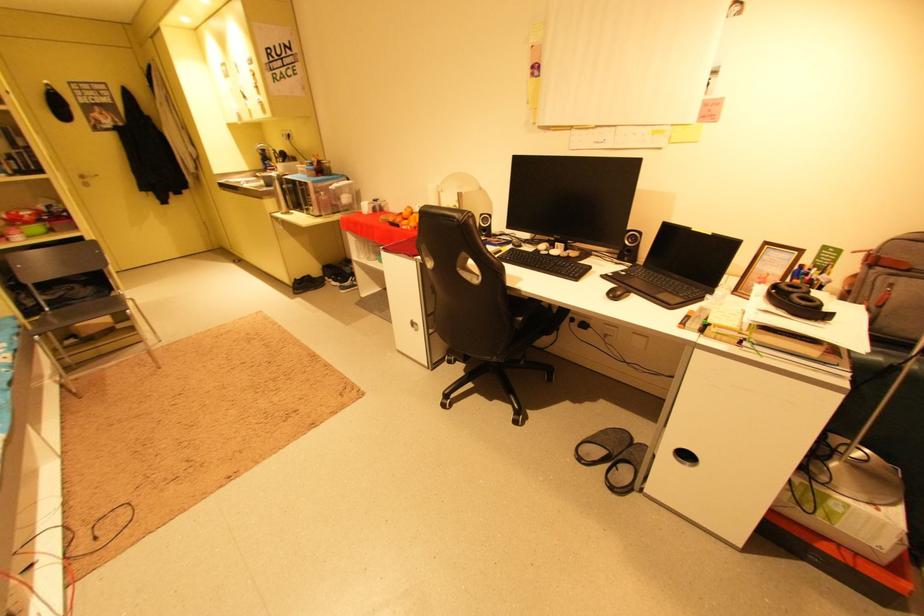
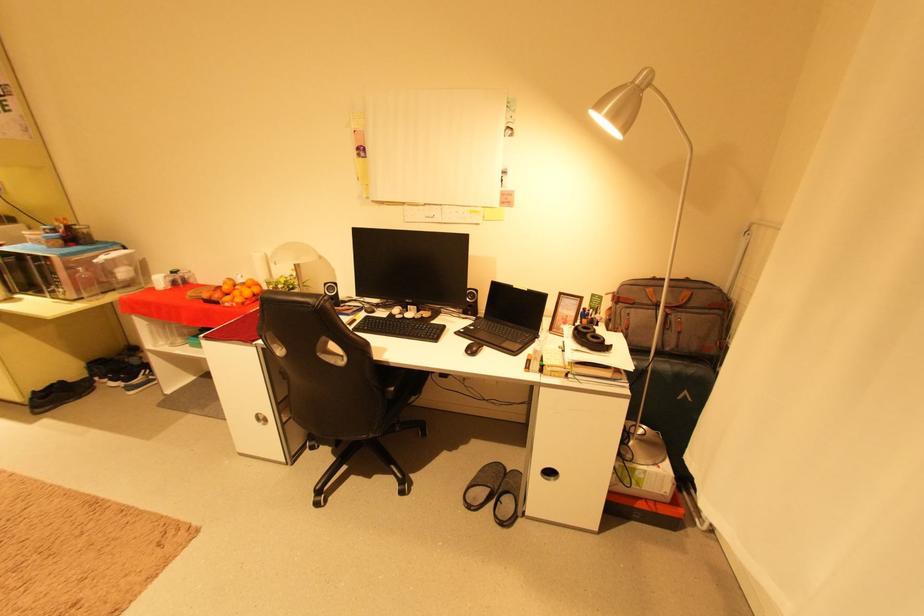
The point at [621,286] is marked in the first image. Where is the corresponding point in the second image?

(475, 342)